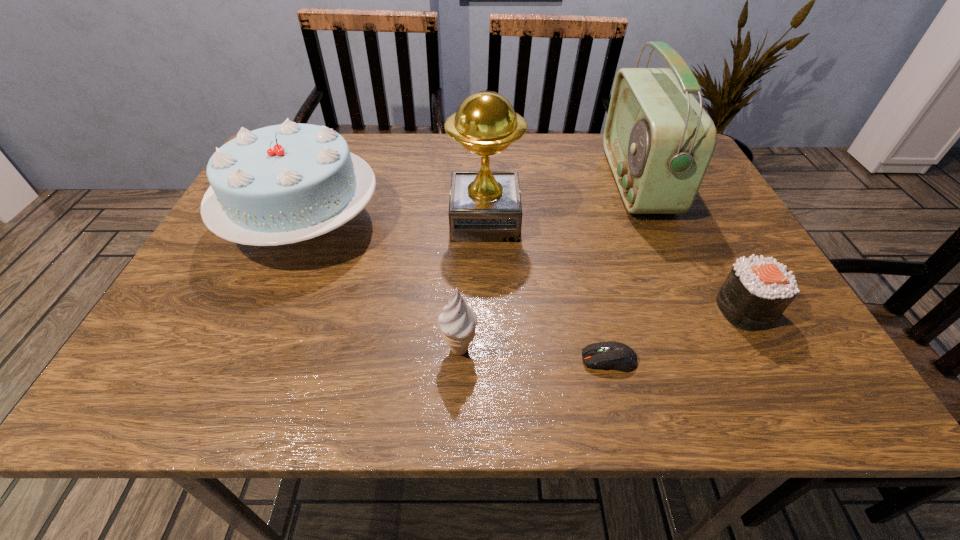
This screenshot has width=960, height=540. What are the coordinates of `vacant space situated on the button of the shortest object` in the screenshot? It's located at (459, 360).

What are the coordinates of `radio receiver present at the far edge` in the screenshot? It's located at (659, 141).

The image size is (960, 540). I want to click on birthday cake present at the far edge, so click(x=281, y=184).

Find the location of a particular element. This screenshot has height=540, width=960. icecream at the near edge is located at coordinates (458, 321).

What are the coordinates of `computer equipment located at the near edge` in the screenshot? It's located at (617, 356).

I want to click on object located at the left edge, so click(281, 184).

This screenshot has height=540, width=960. Find the location of `radio receiver located at the right edge`. radio receiver located at the right edge is located at coordinates (659, 141).

The image size is (960, 540). Identify the location of sushi that is at the right edge. (757, 291).

The image size is (960, 540). What are the coordinates of `object that is at the far left corner` in the screenshot? It's located at (281, 184).

Where is `object that is positioned at the far right corner`? The width and height of the screenshot is (960, 540). object that is positioned at the far right corner is located at coordinates (659, 141).